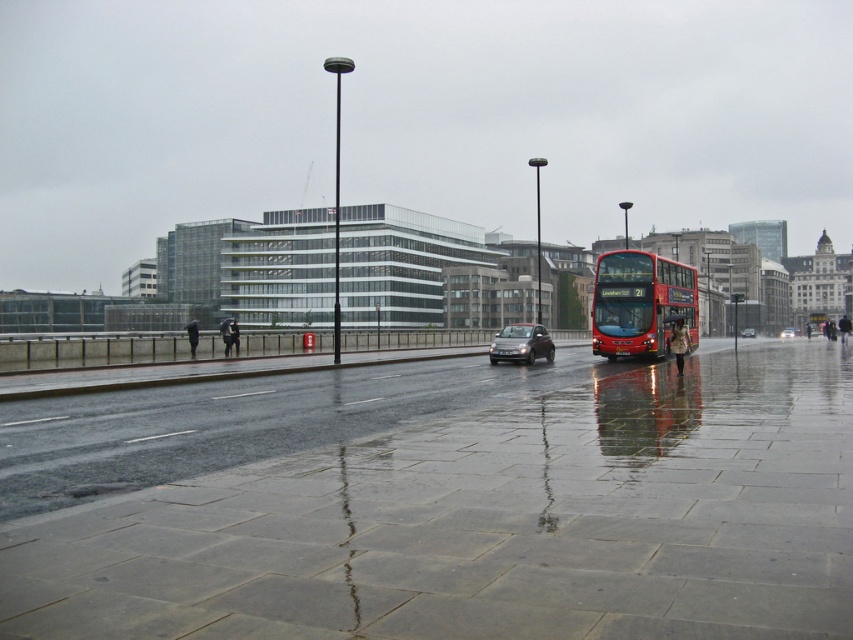
Is red metallic bus at center taller than metallic bus stop at center?

In fact, red metallic bus at center may be shorter than metallic bus stop at center.

Between point (625, 257) and point (727, 330), which one is positioned in front?

Point (625, 257) is more forward.

Who is more distant from viewer, (624,289) or (749,307)?

The point (749,307) is behind.

You are a GUI agent. You are given a task and a screenshot of the screen. Output one action in this format:
    pyautogui.click(x=<x>, y=<y>)
    Task: Click on the red metallic bus at center
    The width and height of the screenshot is (853, 640).
    Given the screenshot: What is the action you would take?
    pyautogui.click(x=639, y=301)

Looking at this image, can you confirm if metallic bus stop at center is wider than shiny black car at center?

Yes.

Is metallic bus stop at center taller than shiny black car at center?

Yes, metallic bus stop at center is taller than shiny black car at center.

Locate an element on the screen. This screenshot has height=640, width=853. metallic bus stop at center is located at coordinates (746, 316).

At what (x,y) coordinates should I click in order to perform the action: click on metallic bus stop at center. Please return your answer as a coordinate pair (x, y). This screenshot has width=853, height=640. Looking at the image, I should click on (746, 316).

Is red metallic bus at center below shiny silver car at center?

Actually, red metallic bus at center is above shiny silver car at center.

Which is behind, point (640, 276) or point (787, 328)?

The point (787, 328) is behind.

Find the location of `red metallic bus at center`. red metallic bus at center is located at coordinates (639, 301).